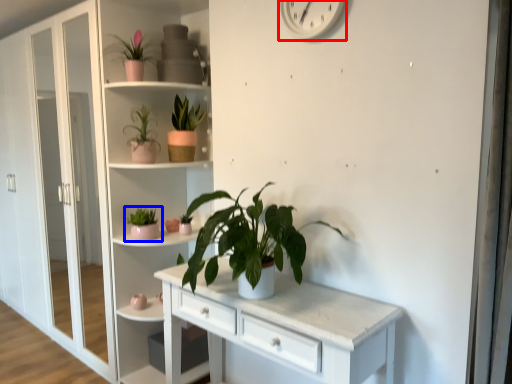
Question: Among these objects, which one is nearest to the camera, clock (highlighted by a red box) or houseplant (highlighted by a blue box)?

Choices:
 (A) clock
 (B) houseplant

Answer: (A)